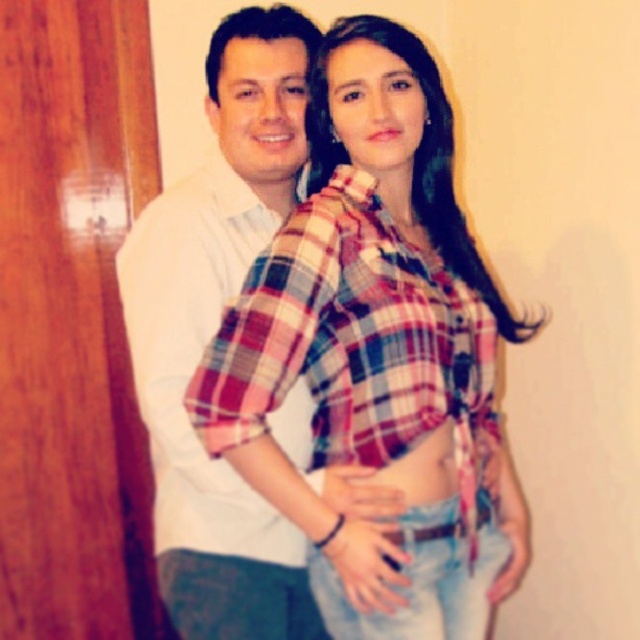
Who is taller, plaid fabric shirt at center or smooth fabric belly at center?

plaid fabric shirt at center

Who is positioned more to the right, plaid fabric shirt at center or smooth fabric belly at center?

Positioned to the right is plaid fabric shirt at center.

Which is behind, point (445, 307) or point (344, 512)?

Point (445, 307)

Locate an element on the screen. Image resolution: width=640 pixels, height=640 pixels. plaid fabric shirt at center is located at coordinates (378, 353).

Is plaid cotton shirt at center below smooth fabric belly at center?

Incorrect, plaid cotton shirt at center is not positioned below smooth fabric belly at center.

Is plaid cotton shirt at center wider than smooth fabric belly at center?

Indeed, plaid cotton shirt at center has a greater width compared to smooth fabric belly at center.

Does point (252, 211) lie behind point (385, 474)?

Yes, point (252, 211) is behind point (385, 474).

What are the coordinates of `plaid cotton shirt at center` in the screenshot? It's located at (195, 358).

Who is lower down, plaid fabric shirt at center or plaid cotton shirt at center?

plaid cotton shirt at center

Is plaid fabric shirt at center smaller than plaid cotton shirt at center?

No.

Does point (424, 508) come closer to viewer compared to point (147, 406)?

Yes, it is.

Locate an element on the screen. The height and width of the screenshot is (640, 640). plaid fabric shirt at center is located at coordinates [x=378, y=353].